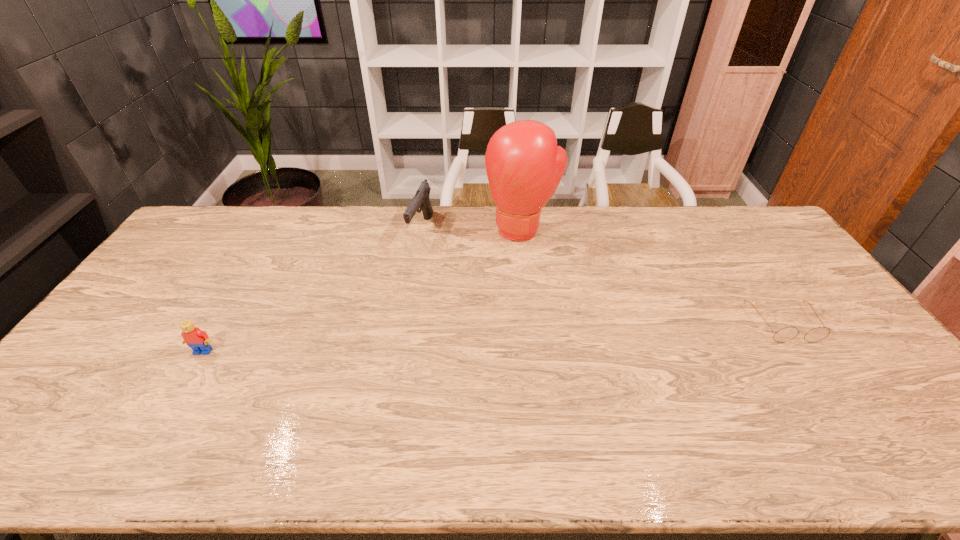
Find the location of a particular element. free space between the rightmost object and the second tallest object is located at coordinates (603, 277).

Locate an element on the screen. This screenshot has width=960, height=540. free spot between the third tallest object and the shortest object is located at coordinates (493, 338).

Identify the location of free space between the third object from right to left and the third tallest object. (312, 291).

You are a GUI agent. You are given a task and a screenshot of the screen. Output one action in this format:
    pyautogui.click(x=<x>, y=<y>)
    Task: Click on the free space between the second shortest object and the rightmost object
    The height and width of the screenshot is (540, 960).
    Given the screenshot: What is the action you would take?
    pyautogui.click(x=493, y=338)

Where is `free spot between the boxing glove and the shortest object`? free spot between the boxing glove and the shortest object is located at coordinates (653, 276).

What are the coordinates of `object that stands as the third closest to the spectacles` in the screenshot? It's located at (198, 340).

I want to click on object that ranks as the third closest to the second object from right to left, so click(x=198, y=340).